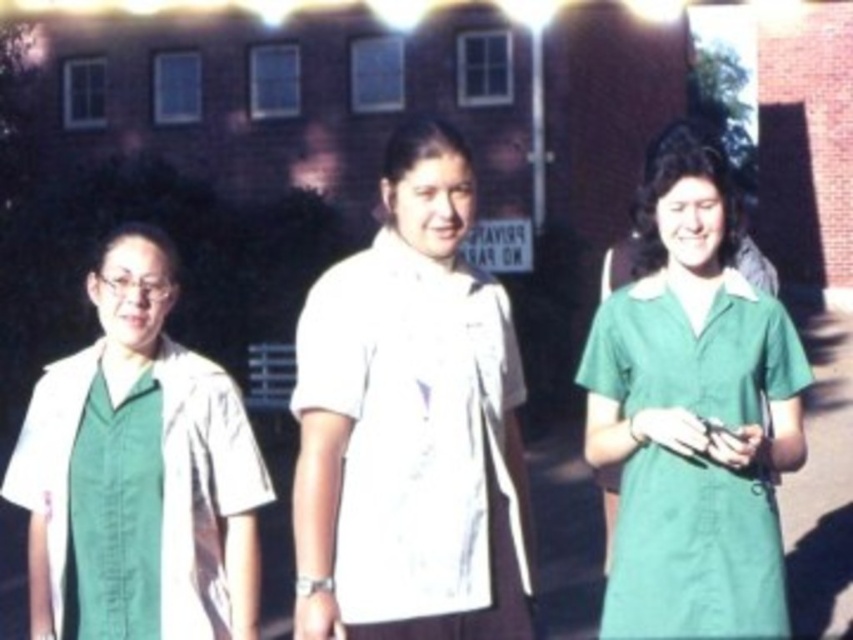
Is point (746, 397) positioned behind point (440, 364)?

Yes, point (746, 397) is farther from viewer.

Does green fabric dress at center have a greater width compared to white cotton shirt at center?

No, green fabric dress at center is not wider than white cotton shirt at center.

Measure the distance between green fabric dress at center and camera.

12.01 feet

At what (x,y) coordinates should I click in order to perform the action: click on green fabric dress at center. Please return your answer as a coordinate pair (x, y). This screenshot has height=640, width=853. Looking at the image, I should click on (693, 417).

What do you see at coordinates (693, 417) in the screenshot?
I see `green fabric dress at center` at bounding box center [693, 417].

I want to click on green fabric dress at center, so click(693, 417).

The height and width of the screenshot is (640, 853). Describe the element at coordinates (138, 472) in the screenshot. I see `green fabric shirt at center` at that location.

Does green fabric shirt at center have a lesser width compared to white cotton shirt at center?

Incorrect, green fabric shirt at center's width is not less than white cotton shirt at center's.

Locate an element on the screen. This screenshot has width=853, height=640. green fabric shirt at center is located at coordinates (138, 472).